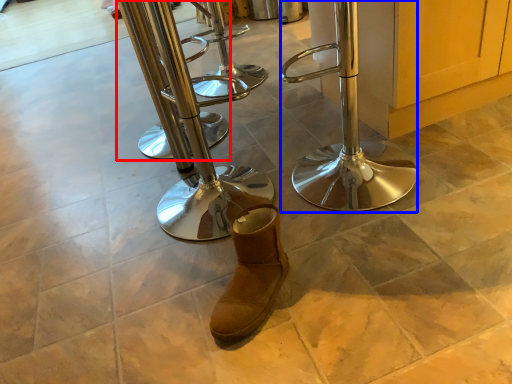
Question: Which object appears closest to the camera in this image, step stool (highlighted by a red box) or step stool (highlighted by a blue box)?

Choices:
 (A) step stool
 (B) step stool

Answer: (B)